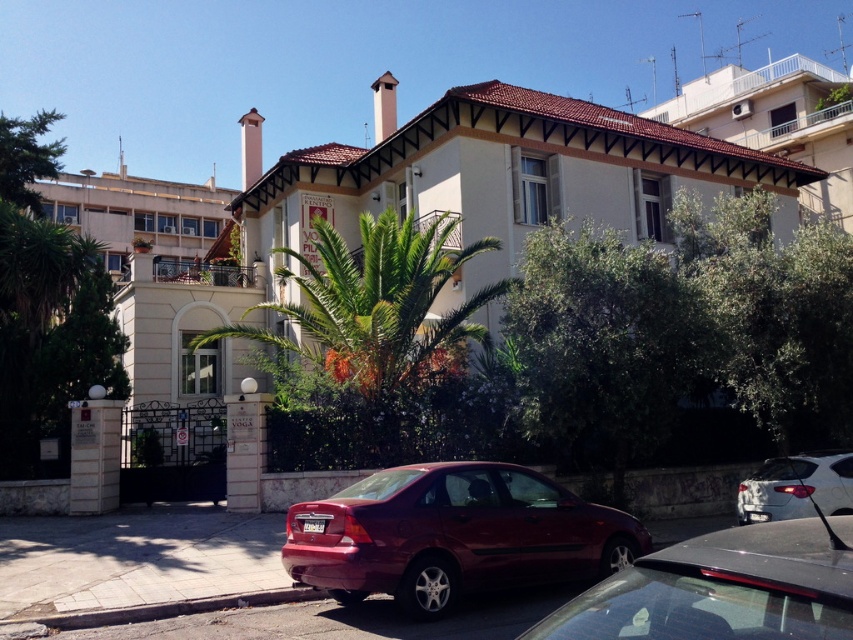
Question: Does shiny red sedan at lower center have a greater width compared to shiny black sedan at center?

Choices:
 (A) no
 (B) yes

Answer: (B)

Question: Does shiny red sedan at lower center appear on the right side of white glossy sedan at lower right?

Choices:
 (A) yes
 (B) no

Answer: (B)

Question: Which object is the closest to the shiny red sedan at lower center?

Choices:
 (A) white glossy sedan at lower right
 (B) shiny black sedan at center

Answer: (A)

Question: Which of the following is the farthest from the observer?

Choices:
 (A) shiny black sedan at center
 (B) white glossy sedan at lower right
 (C) shiny red sedan at lower center

Answer: (B)

Question: Is shiny red sedan at lower center behind shiny black sedan at center?

Choices:
 (A) yes
 (B) no

Answer: (A)

Question: Among these objects, which one is farthest from the camera?

Choices:
 (A) shiny black sedan at center
 (B) shiny red sedan at lower center
 (C) white glossy sedan at lower right

Answer: (C)